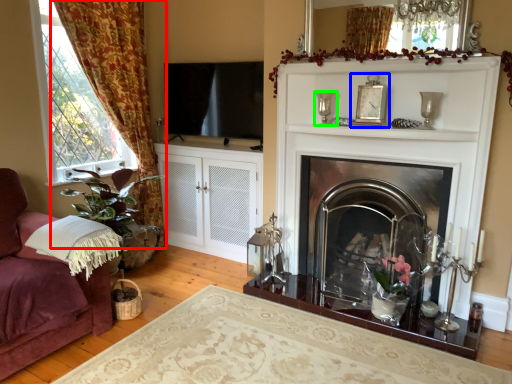
Question: Which object is the farthest from curtain (highlighted by a red box)? Choose among these: picture frame (highlighted by a blue box) or candle holder (highlighted by a green box).

Choices:
 (A) picture frame
 (B) candle holder

Answer: (A)